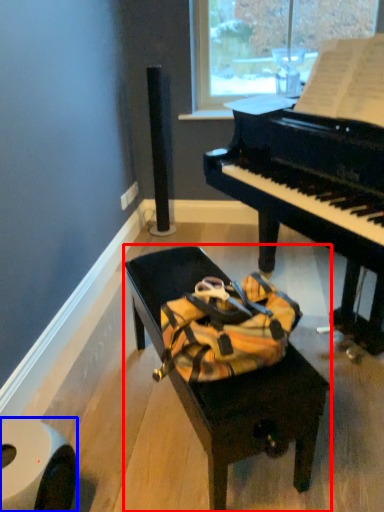
Question: Which point is closer to the camera, furniture (highlighted by a red box) or toilet paper (highlighted by a blue box)?

Choices:
 (A) furniture
 (B) toilet paper

Answer: (B)